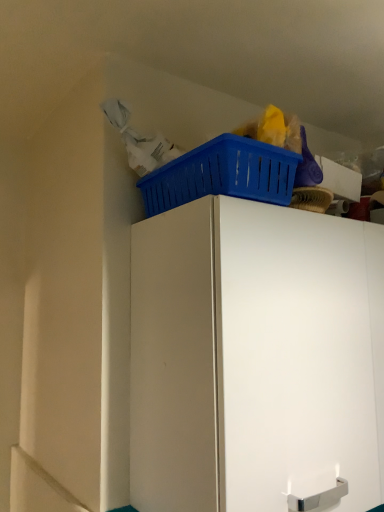
Question: In terms of width, does white matte cabinet at upper center look wider or thinner when compared to blue plastic basket at upper right?

Choices:
 (A) thin
 (B) wide

Answer: (B)

Question: From the image's perspective, is white matte cabinet at upper center located above or below blue plastic basket at upper right?

Choices:
 (A) above
 (B) below

Answer: (B)

Question: In terms of height, does white matte cabinet at upper center look taller or shorter compared to blue plastic basket at upper right?

Choices:
 (A) tall
 (B) short

Answer: (A)

Question: Is blue plastic basket at upper right spatially inside white matte cabinet at upper center, or outside of it?

Choices:
 (A) inside
 (B) outside

Answer: (B)

Question: Is blue plastic basket at upper right in front of or behind white matte cabinet at upper center in the image?

Choices:
 (A) behind
 (B) front

Answer: (A)

Question: Considering the positions of blue plastic basket at upper right and white matte cabinet at upper center in the image, is blue plastic basket at upper right taller or shorter than white matte cabinet at upper center?

Choices:
 (A) short
 (B) tall

Answer: (A)

Question: From a real-world perspective, is blue plastic basket at upper right above or below white matte cabinet at upper center?

Choices:
 (A) below
 (B) above

Answer: (B)